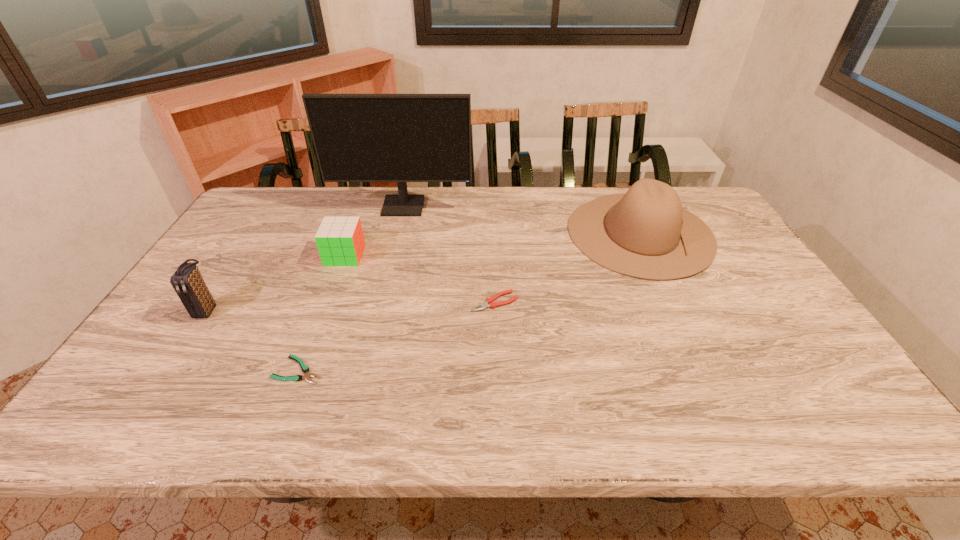
At what (x,y) coordinates should I click in order to perform the action: click on vacant space at the far edge of the desktop. Please return your answer as a coordinate pair (x, y). Looking at the image, I should click on (492, 210).

Locate an element on the screen. vacant space at the near edge of the desktop is located at coordinates 245,394.

In the image, there is a desktop. Identify the location of vacant space at the left edge. The height and width of the screenshot is (540, 960). (202, 359).

The width and height of the screenshot is (960, 540). In the image, there is a desktop. In order to click on free space at the right edge in this screenshot , I will do `click(721, 273)`.

In the image, there is a desktop. At what (x,y) coordinates should I click in order to perform the action: click on vacant space at the far left corner. Please return your answer as a coordinate pair (x, y). Looking at the image, I should click on (294, 187).

Identify the location of blank space at the near left corner. Image resolution: width=960 pixels, height=540 pixels. (128, 413).

Identify the location of free space at the near right corner of the desktop. This screenshot has height=540, width=960. (831, 409).

Identify the location of free area in between the fourth tallest object and the sombrero. [x=492, y=244].

Find the location of `empty location between the leftmost object and the third shortest object`. empty location between the leftmost object and the third shortest object is located at coordinates [x=276, y=283].

The width and height of the screenshot is (960, 540). In order to click on free space between the sombrero and the leftmost object in this screenshot , I will do `click(423, 272)`.